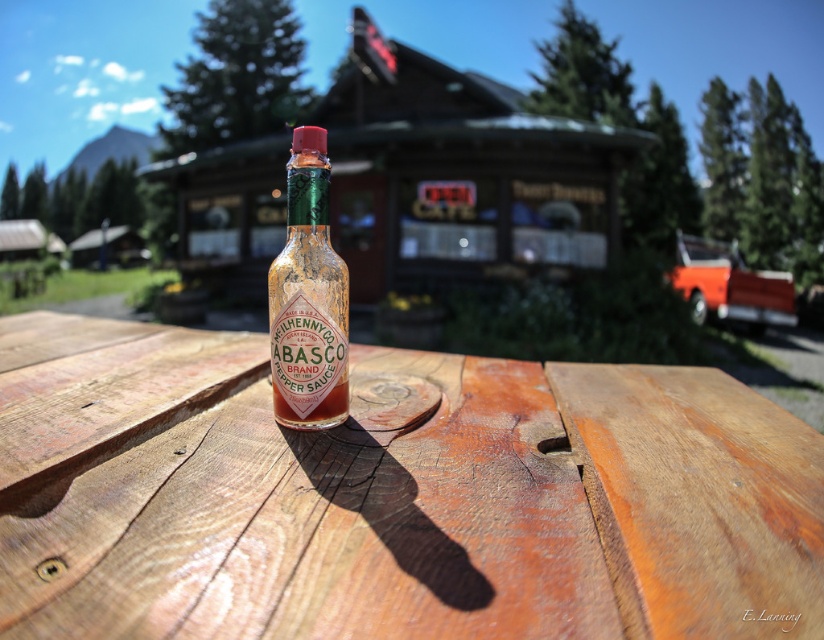
Question: Is wooden picnic table at center above matte glass tabasco bottle at center?

Choices:
 (A) no
 (B) yes

Answer: (A)

Question: Which point is closer to the camera?

Choices:
 (A) (48, 454)
 (B) (325, 138)

Answer: (A)

Question: Is wooden picnic table at center bigger than matte glass tabasco bottle at center?

Choices:
 (A) no
 (B) yes

Answer: (B)

Question: Is wooden picnic table at center to the left of matte glass tabasco bottle at center from the viewer's perspective?

Choices:
 (A) no
 (B) yes

Answer: (B)